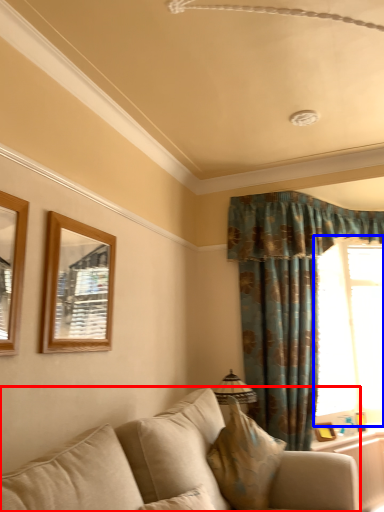
Question: Among these objects, which one is nearest to the camera, studio couch (highlighted by a red box) or window (highlighted by a blue box)?

Choices:
 (A) studio couch
 (B) window

Answer: (A)